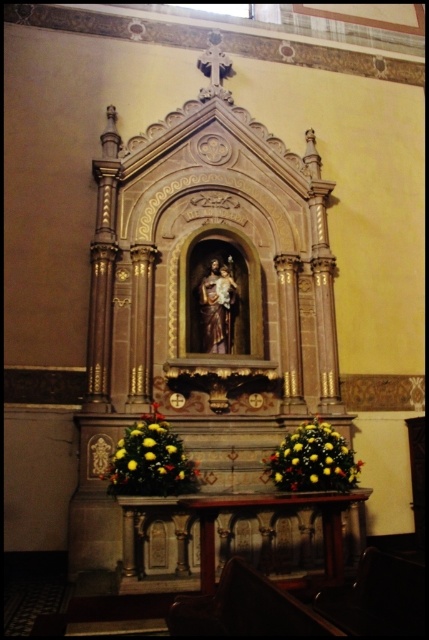
Question: Is the position of yellow floral arrangement at center less distant than that of yellow floral arrangement at lower center?

Choices:
 (A) no
 (B) yes

Answer: (B)

Question: Does yellow floral arrangement at center appear on the right side of yellow floral arrangement at lower center?

Choices:
 (A) no
 (B) yes

Answer: (A)

Question: Is yellow floral arrangement at center to the left of yellow floral arrangement at lower center from the viewer's perspective?

Choices:
 (A) no
 (B) yes

Answer: (B)

Question: Which of the following is the closest to the observer?

Choices:
 (A) yellow floral arrangement at lower center
 (B) yellow floral arrangement at center

Answer: (B)

Question: Which of the following is the farthest from the observer?

Choices:
 (A) (305, 438)
 (B) (129, 472)

Answer: (A)